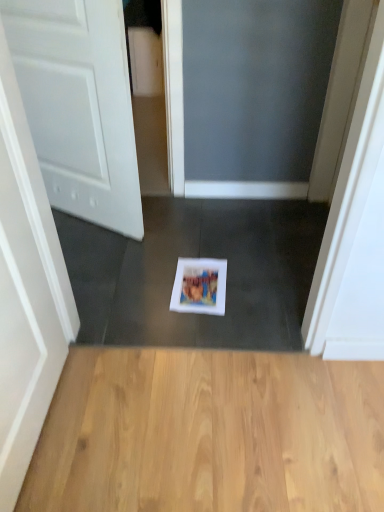
I want to click on empty space that is ontop of light brown wood flooring at center (from a real-world perspective), so click(x=211, y=418).